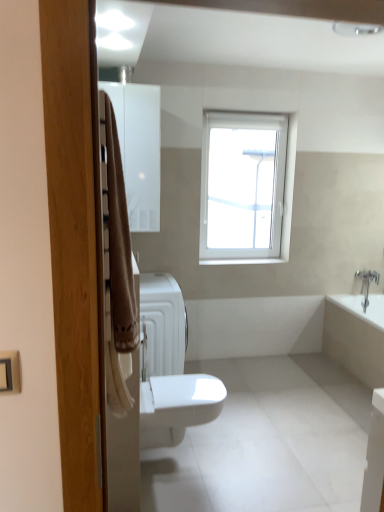
Question: Does white glossy medicine cabinet at upper left lie behind white glossy bathtub at lower right?

Choices:
 (A) yes
 (B) no

Answer: (B)

Question: Does white glossy medicine cabinet at upper left have a lesser height compared to white glossy bathtub at lower right?

Choices:
 (A) yes
 (B) no

Answer: (B)

Question: Is white glossy medicine cabinet at upper left completely or partially outside of white glossy bathtub at lower right?

Choices:
 (A) yes
 (B) no

Answer: (A)

Question: Does white glossy medicine cabinet at upper left appear on the right side of white glossy bathtub at lower right?

Choices:
 (A) no
 (B) yes

Answer: (A)

Question: From a real-world perspective, is white glossy medicine cabinet at upper left located beneath white glossy bathtub at lower right?

Choices:
 (A) no
 (B) yes

Answer: (A)

Question: In terms of size, does white glossy medicine cabinet at upper left appear bigger or smaller than beige fabric towel at left?

Choices:
 (A) small
 (B) big

Answer: (B)

Question: Is white glossy medicine cabinet at upper left taller or shorter than beige fabric towel at left?

Choices:
 (A) tall
 (B) short

Answer: (A)

Question: In terms of width, does white glossy medicine cabinet at upper left look wider or thinner when compared to beige fabric towel at left?

Choices:
 (A) wide
 (B) thin

Answer: (A)

Question: Which is correct: white glossy medicine cabinet at upper left is inside beige fabric towel at left, or outside of it?

Choices:
 (A) inside
 (B) outside

Answer: (B)

Question: Do you think white plastic window at upper center is within white glossy bidet at center, or outside of it?

Choices:
 (A) outside
 (B) inside

Answer: (A)

Question: Is white plastic window at upper center wider or thinner than white glossy bidet at center?

Choices:
 (A) wide
 (B) thin

Answer: (B)

Question: Considering the positions of point (284, 237) and point (165, 432), is point (284, 237) closer or farther from the camera than point (165, 432)?

Choices:
 (A) farther
 (B) closer

Answer: (A)

Question: From the image's perspective, is white plastic window at upper center positioned above or below white glossy bidet at center?

Choices:
 (A) below
 (B) above

Answer: (B)

Question: From the image's perspective, is white glossy medicine cabinet at upper left positioned above or below white plastic window at upper center?

Choices:
 (A) above
 (B) below

Answer: (A)

Question: Considering the positions of point (127, 141) and point (215, 123), is point (127, 141) closer or farther from the camera than point (215, 123)?

Choices:
 (A) farther
 (B) closer

Answer: (B)